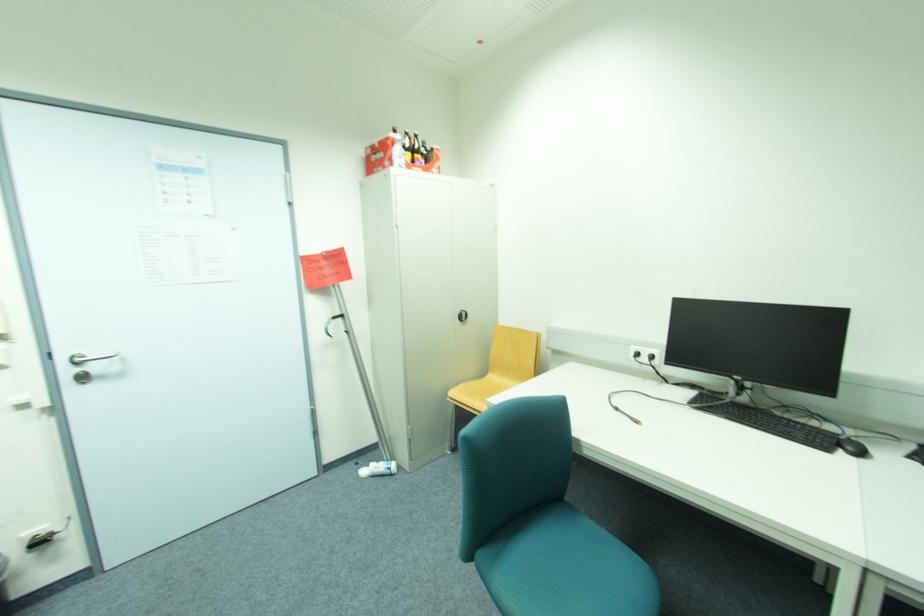
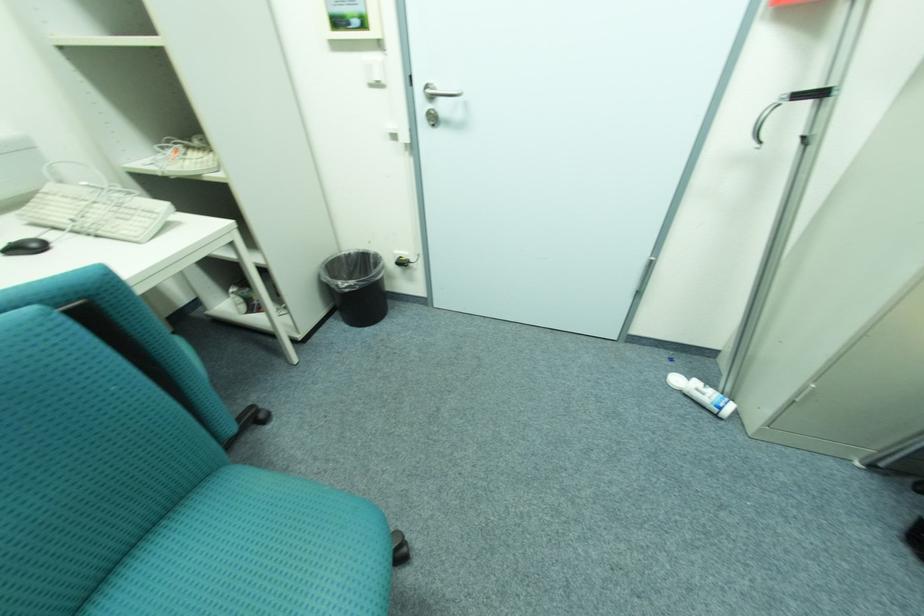
Locate, in the second image, the point that corresponds to [371,472] in the first image.

(683, 381)